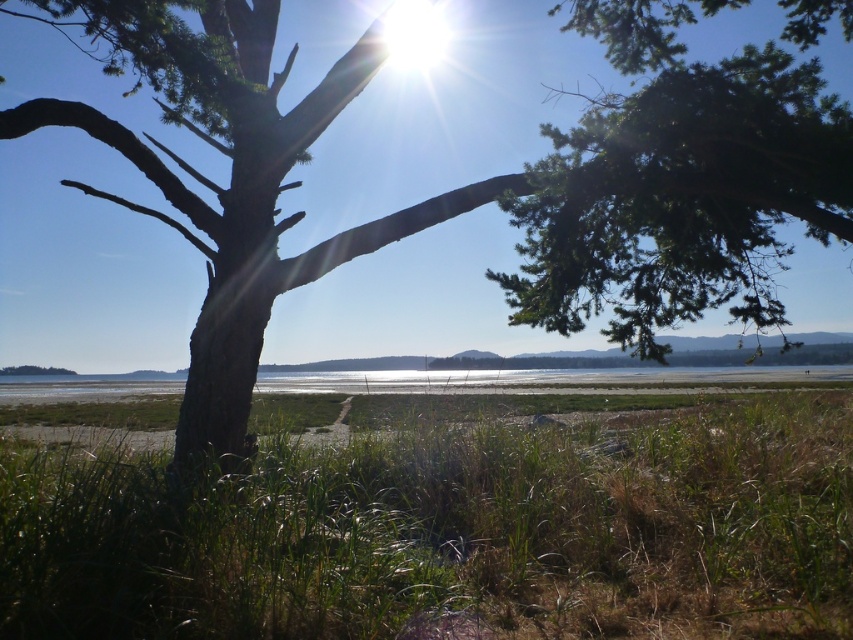
Is green grassy at lower center shorter than green needle-like foliage at upper center?

Yes, green grassy at lower center is shorter than green needle-like foliage at upper center.

Is point (461, 570) in front of point (509, 285)?

Yes, it is.

Between point (514, 624) and point (779, 60), which one is positioned in front?

Positioned in front is point (514, 624).

Locate an element on the screen. Image resolution: width=853 pixels, height=640 pixels. green grassy at lower center is located at coordinates (450, 532).